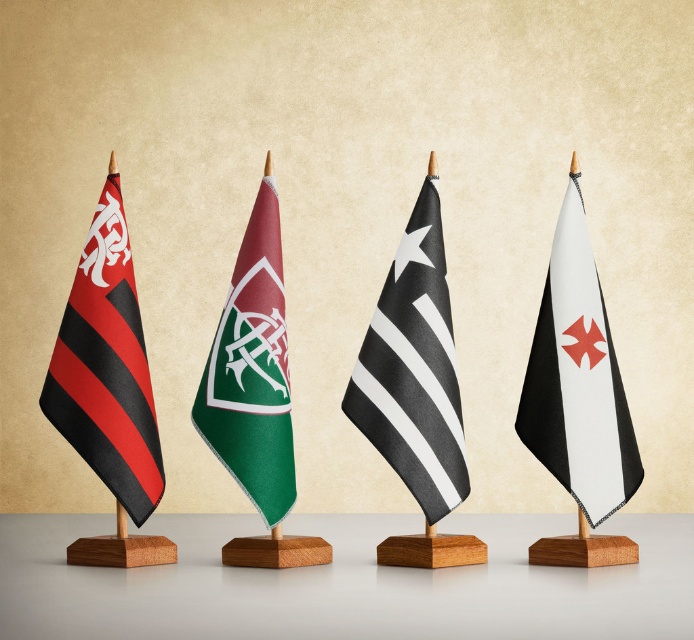
You are an art curator arranging flags in a gallery. You need to place a new flag between the matte black and red striped flag at left and the green fabric flag at center. Considering their positions, which flag should the new flag be placed closer to?

The new flag should be placed closer to the matte black and red striped flag at left because it is closer to the viewer than the green fabric flag at center.

You are an art curator arranging an exhibition. You have two flags to display next to each other on a wall. The matte black and red striped flag at left and the green fabric flag at center. Based on their sizes, which flag should you place on the left side to ensure proper visual balance?

The matte black and red striped flag at left is larger in size compared to the green fabric flag at center. To achieve visual balance, place the larger matte black and red striped flag at left on the left side so its size can counterbalance the smaller green fabric flag at center on the right.